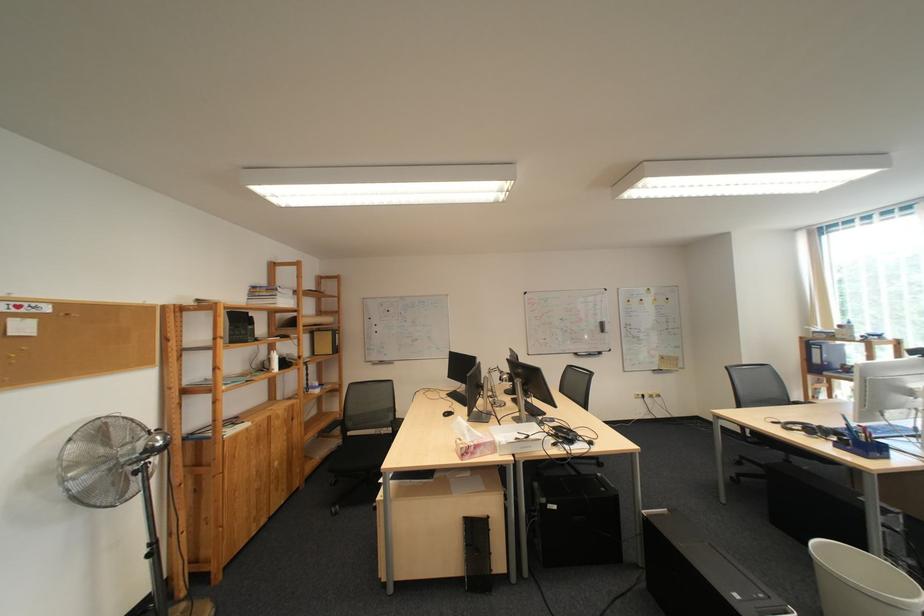
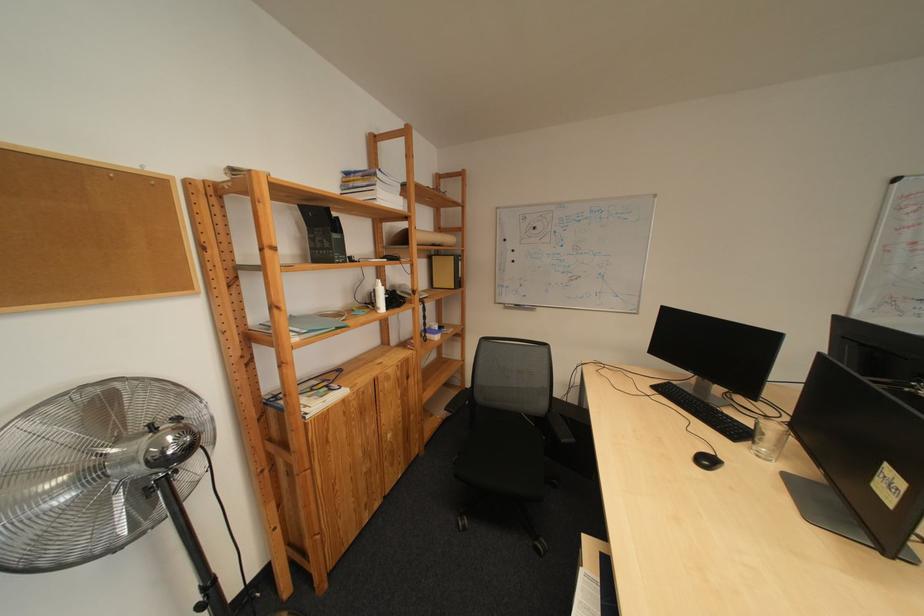
In a continuous first-person perspective shot, in which direction is the camera moving?

The movement direction of the cameraman is left, forward.